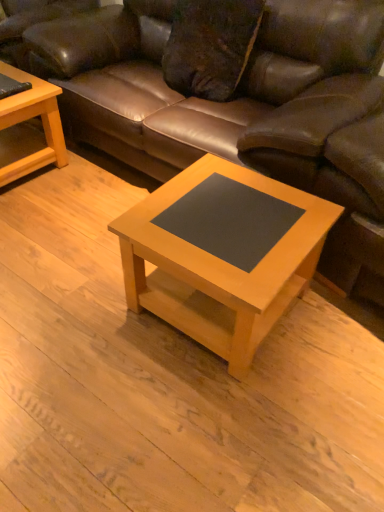
Locate an element on the screen. light wood/black laminate coffee table at center, the 2th coffee table when ordered from left to right is located at coordinates (222, 254).

At what (x,y) coordinates should I click in order to perform the action: click on brown leather couch at center. Please return your answer as a coordinate pair (x, y). Image resolution: width=384 pixels, height=512 pixels. Looking at the image, I should click on (234, 106).

Identify the location of light wood/black laminate coffee table at center, placed as the first coffee table when sorted from right to left. coord(222,254).

Can you tell me how much light wood/finely finished coffee table at left, which is counted as the 2th coffee table, starting from the front, and light wood/black laminate coffee table at center, which is the 1th coffee table from bottom to top, differ in facing direction?

3.33 degrees.

Could light wood/black laminate coffee table at center, the 2th coffee table when ordered from left to right, be considered to be inside light wood/finely finished coffee table at left, the first coffee table viewed from the top?

No, light wood/black laminate coffee table at center, the 2th coffee table when ordered from left to right, is located outside of light wood/finely finished coffee table at left, the first coffee table viewed from the top.

In order to click on coffee table that appears behind the light wood/black laminate coffee table at center, which is counted as the second coffee table, starting from the back in this screenshot , I will do `click(31, 133)`.

Would you say light wood/finely finished coffee table at left, which is counted as the 2th coffee table, starting from the front, is to the left or to the right of light wood/black laminate coffee table at center, arranged as the first coffee table when viewed from the front, in the picture?

Based on their positions, light wood/finely finished coffee table at left, which is counted as the 2th coffee table, starting from the front, is located to the left of light wood/black laminate coffee table at center, arranged as the first coffee table when viewed from the front.

Does light wood/finely finished coffee table at left, which is counted as the 2th coffee table, starting from the front, have a lesser width compared to brown leather couch at center?

Yes.

Is the position of light wood/finely finished coffee table at left, the 2th coffee table viewed from the right, more distant than that of brown leather couch at center?

Yes, light wood/finely finished coffee table at left, the 2th coffee table viewed from the right, is behind brown leather couch at center.

Is light wood/finely finished coffee table at left, the 1th coffee table in the back-to-front sequence, situated inside brown leather couch at center or outside?

light wood/finely finished coffee table at left, the 1th coffee table in the back-to-front sequence, is not enclosed by brown leather couch at center.

Consider the image. Is light wood/finely finished coffee table at left, the first coffee table viewed from the top, shorter than brown leather couch at center?

Yes, light wood/finely finished coffee table at left, the first coffee table viewed from the top, is shorter than brown leather couch at center.

Is light wood/black laminate coffee table at center, the 2th coffee table when ordered from left to right, placed right next to brown leather couch at center?

No, light wood/black laminate coffee table at center, the 2th coffee table when ordered from left to right, is not touching brown leather couch at center.

In the image, is light wood/black laminate coffee table at center, the 2th coffee table when ordered from left to right, on the left side or the right side of brown leather couch at center?

light wood/black laminate coffee table at center, the 2th coffee table when ordered from left to right, is positioned on brown leather couch at center's right side.

Which is closer, (195, 300) or (87, 12)?

Point (195, 300) is closer to the camera than point (87, 12).

From a real-world perspective, which is physically above, light wood/black laminate coffee table at center, arranged as the 2th coffee table when viewed from the top, or brown leather couch at center?

brown leather couch at center is physically above.

From their relative heights in the image, would you say brown leather couch at center is taller or shorter than light wood/black laminate coffee table at center, the 2th coffee table when ordered from left to right?

Considering their sizes, brown leather couch at center has more height than light wood/black laminate coffee table at center, the 2th coffee table when ordered from left to right.

Is brown leather couch at center to the left or to the right of light wood/black laminate coffee table at center, placed as the first coffee table when sorted from right to left, in the image?

brown leather couch at center is positioned on light wood/black laminate coffee table at center, placed as the first coffee table when sorted from right to left,'s left side.

From a real-world perspective, does brown leather couch at center sit lower than light wood/black laminate coffee table at center, arranged as the 2th coffee table when viewed from the top?

No, from a real-world perspective, brown leather couch at center is not beneath light wood/black laminate coffee table at center, arranged as the 2th coffee table when viewed from the top.

From a real-world perspective, which object rests below the other?

From a 3D spatial view, light wood/finely finished coffee table at left, which is the first coffee table in left-to-right order, is below.

Is light wood/black laminate coffee table at center, the 2th coffee table when ordered from left to right, further to camera compared to light wood/finely finished coffee table at left, which appears as the second coffee table when ordered from the bottom?

No, it is in front of light wood/finely finished coffee table at left, which appears as the second coffee table when ordered from the bottom.

Does light wood/black laminate coffee table at center, which is counted as the second coffee table, starting from the back, turn towards light wood/finely finished coffee table at left, which is counted as the 2th coffee table, starting from the front?

No, light wood/black laminate coffee table at center, which is counted as the second coffee table, starting from the back, is not facing towards light wood/finely finished coffee table at left, which is counted as the 2th coffee table, starting from the front.

Looking at this image, which object is further away from the camera taking this photo, brown leather couch at center or light wood/finely finished coffee table at left, the 2th coffee table viewed from the right?

Positioned behind is light wood/finely finished coffee table at left, the 2th coffee table viewed from the right.

Based on the photo, can you confirm if brown leather couch at center is thinner than light wood/finely finished coffee table at left, which appears as the second coffee table when ordered from the bottom?

No, brown leather couch at center is not thinner than light wood/finely finished coffee table at left, which appears as the second coffee table when ordered from the bottom.

Is brown leather couch at center oriented away from light wood/finely finished coffee table at left, which is the first coffee table in left-to-right order?

brown leather couch at center does not have its back to light wood/finely finished coffee table at left, which is the first coffee table in left-to-right order.

Looking at this image, which is closer, (358, 52) or (33, 163)?

Point (358, 52).

What are the coordinates of `coffee table that is on the right side of light wood/finely finished coffee table at left, the 2th coffee table viewed from the right` in the screenshot? It's located at (222, 254).

This screenshot has height=512, width=384. In order to click on studio couch above the light wood/finely finished coffee table at left, which appears as the second coffee table when ordered from the bottom (from a real-world perspective) in this screenshot , I will do `click(234, 106)`.

Considering their positions, is brown leather couch at center positioned further to light wood/finely finished coffee table at left, which is the first coffee table in left-to-right order, than light wood/black laminate coffee table at center, arranged as the first coffee table when viewed from the front?

light wood/black laminate coffee table at center, arranged as the first coffee table when viewed from the front.

Looking at the image, which one is located further to brown leather couch at center, light wood/black laminate coffee table at center, which is counted as the second coffee table, starting from the back, or light wood/finely finished coffee table at left, which is the first coffee table in left-to-right order?

Among the two, light wood/finely finished coffee table at left, which is the first coffee table in left-to-right order, is located further to brown leather couch at center.

From the image, which object appears to be nearer to light wood/finely finished coffee table at left, the first coffee table viewed from the top, light wood/black laminate coffee table at center, the 2th coffee table when ordered from left to right, or brown leather couch at center?

brown leather couch at center is positioned closer to the anchor light wood/finely finished coffee table at left, the first coffee table viewed from the top.

Based on their spatial positions, is light wood/finely finished coffee table at left, the 1th coffee table in the back-to-front sequence, or brown leather couch at center closer to light wood/black laminate coffee table at center, the 2th coffee table when ordered from left to right?

Based on the image, brown leather couch at center appears to be nearer to light wood/black laminate coffee table at center, the 2th coffee table when ordered from left to right.

Which object lies nearer to the anchor point light wood/black laminate coffee table at center, which is the 1th coffee table from bottom to top, brown leather couch at center or light wood/finely finished coffee table at left, which is counted as the 2th coffee table, starting from the front?

brown leather couch at center is closer to light wood/black laminate coffee table at center, which is the 1th coffee table from bottom to top.

From the image, which object appears to be farther from brown leather couch at center, light wood/finely finished coffee table at left, which is the first coffee table in left-to-right order, or light wood/black laminate coffee table at center, which is counted as the second coffee table, starting from the back?

Among the two, light wood/finely finished coffee table at left, which is the first coffee table in left-to-right order, is located further to brown leather couch at center.

The image size is (384, 512). What are the coordinates of `studio couch between light wood/finely finished coffee table at left, which is the first coffee table in left-to-right order, and light wood/black laminate coffee table at center, which is counted as the second coffee table, starting from the back` in the screenshot? It's located at (234, 106).